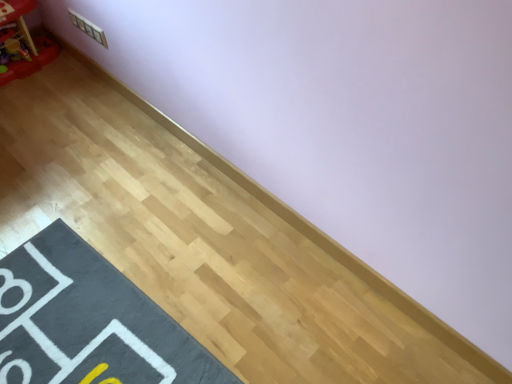
The height and width of the screenshot is (384, 512). What are the coordinates of `free space to the right of matte plastic toy storage at upper left` in the screenshot? It's located at (63, 79).